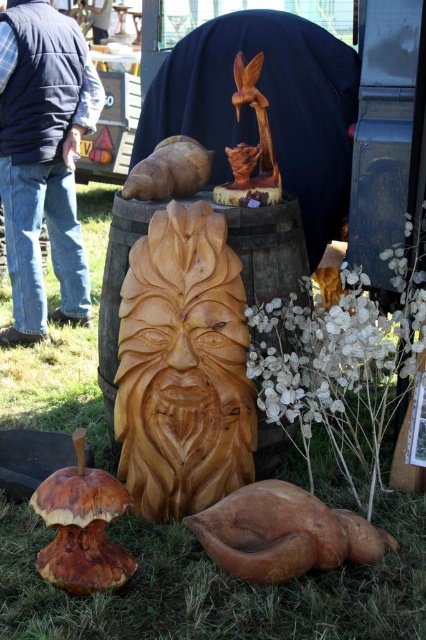
Is green matte wood carving at center in front of brown wood snail at upper center?

Yes, it is.

What do you see at coordinates (215, 588) in the screenshot? Image resolution: width=426 pixels, height=640 pixels. I see `green matte wood carving at center` at bounding box center [215, 588].

The image size is (426, 640). I want to click on green matte wood carving at center, so click(215, 588).

Which is more to the left, green matte wood carving at center or wooden carving at center?

wooden carving at center is more to the left.

How far apart are green matte wood carving at center and wooden carving at center?

green matte wood carving at center is 16.27 inches from wooden carving at center.

Is point (302, 616) in front of point (189, 504)?

Yes, point (302, 616) is in front of point (189, 504).

This screenshot has height=640, width=426. Find the location of `green matte wood carving at center`. green matte wood carving at center is located at coordinates (215, 588).

How distant is wooden carving at center from white matte flowers at center right?

They are 33.95 centimeters apart.

Is wooden carving at center thinner than white matte flowers at center right?

Yes, wooden carving at center is thinner than white matte flowers at center right.

Does point (164, 444) lie in front of point (351, 440)?

Yes, it is.

Locate an element on the screen. wooden carving at center is located at coordinates (183, 368).